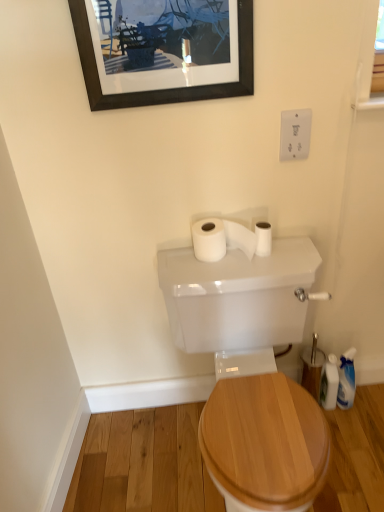
Locate an element on the screen. vacant space situated on the left part of white matte toilet paper at upper center, which appears as the first toilet paper when viewed from the left is located at coordinates (178, 264).